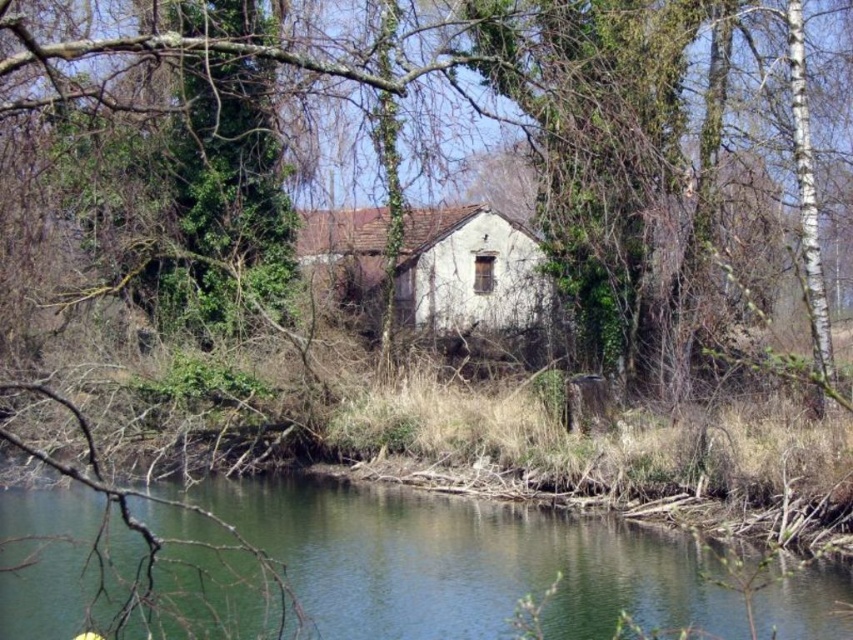
You are standing at the riverside and see the point marked at coordinates [466,563]. Based on the scene description, what is the color of the water at this location?

The point at coordinates [466,563] corresponds to green water at lower center, so the water at this location is green.

You are standing on the riverbank and see the green water at lower center and the white rough wooden hut at center. Which object is located to the right side of the other?

The white rough wooden hut at center is located to the right side of the green water at lower center.